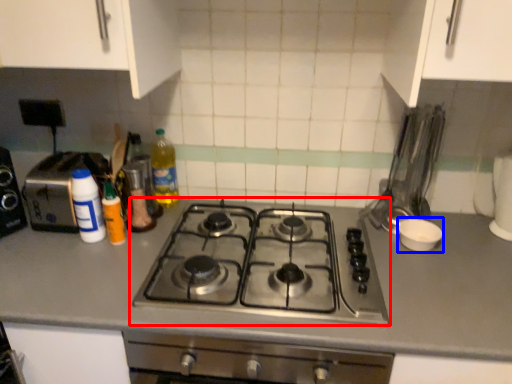
Question: Which object appears closest to the camera in this image, gas stove (highlighted by a red box) or appliance (highlighted by a blue box)?

Choices:
 (A) gas stove
 (B) appliance

Answer: (A)